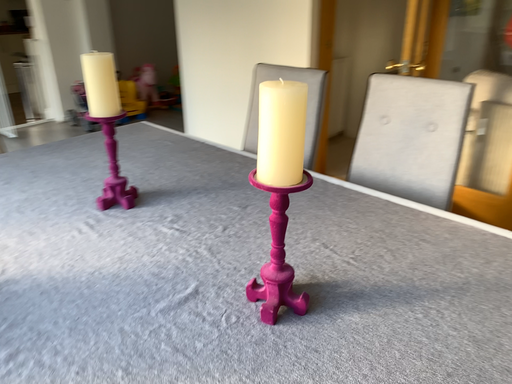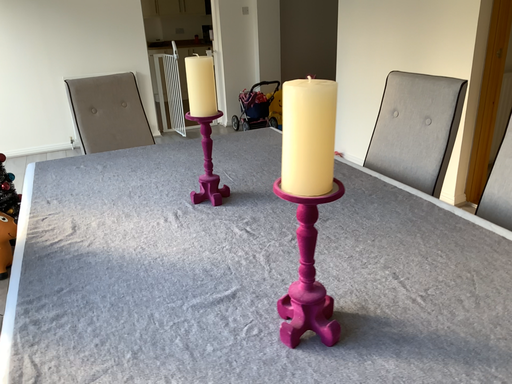
Question: Which way did the camera rotate in the video?

Choices:
 (A) rotated right
 (B) rotated left

Answer: (B)